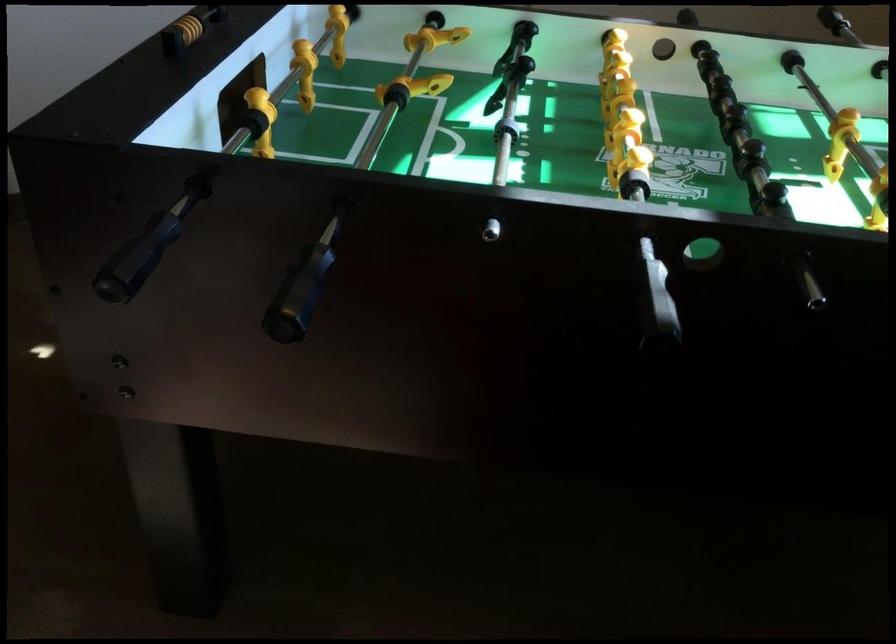
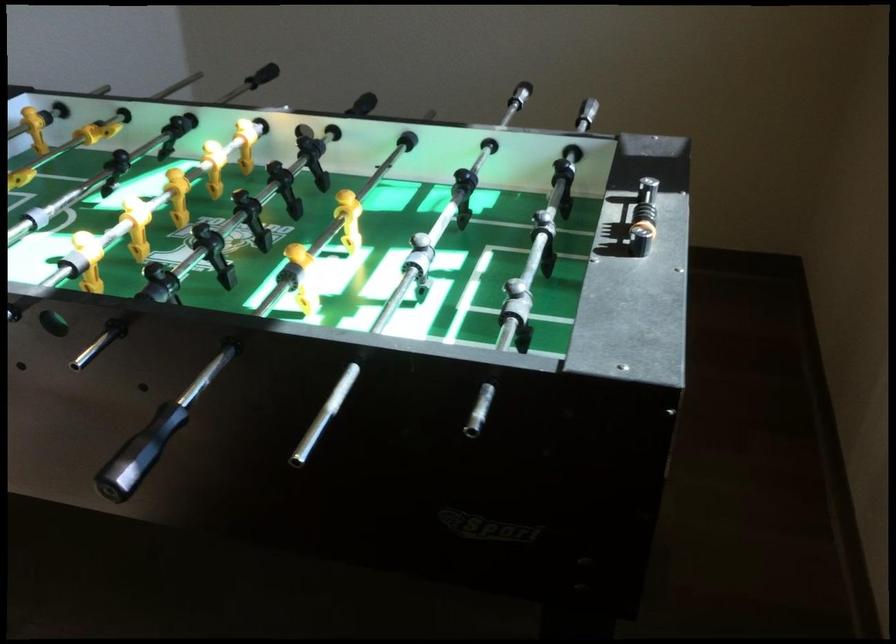
Question: How did the camera likely rotate?

Choices:
 (A) Left
 (B) Right
 (C) Up
 (D) Down

Answer: (A)